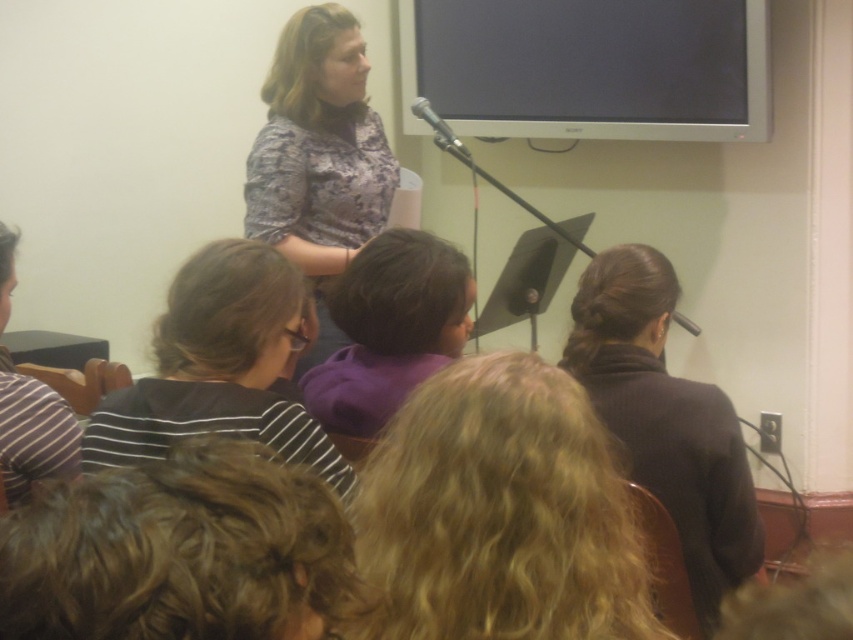
Who is more forward, (91, 544) or (683, 1)?

Point (91, 544)

Locate an element on the screen. The image size is (853, 640). curly blonde hair at lower left is located at coordinates (178, 550).

Can you confirm if striped fabric at left is positioned below metallic silver microphone at upper center?

Indeed, striped fabric at left is positioned under metallic silver microphone at upper center.

Identify the location of striped fabric at left. Image resolution: width=853 pixels, height=640 pixels. (33, 433).

Is point (605, 400) positioned before point (386, 234)?

Yes, point (605, 400) is closer to viewer.

Is point (643, 401) behind point (425, 330)?

Yes, it is behind point (425, 330).

Find the location of a particular element. This screenshot has height=640, width=853. dark brown sweater at center is located at coordinates coord(665,419).